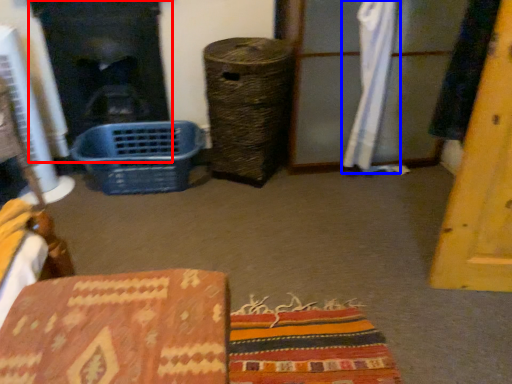
Question: Which object appears farthest to the camera in this image, fireplace (highlighted by a red box) or curtain (highlighted by a blue box)?

Choices:
 (A) fireplace
 (B) curtain

Answer: (A)